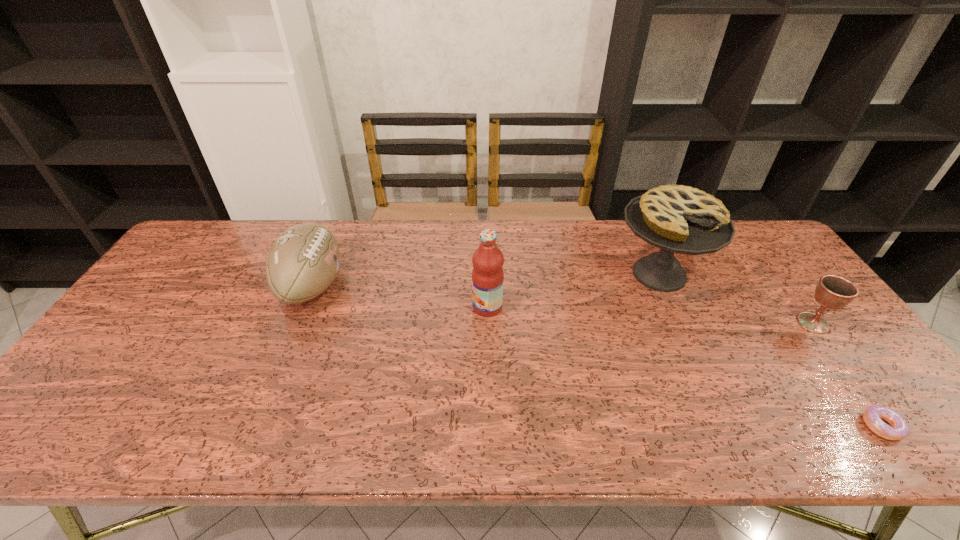
At what (x,y) coordinates should I click in order to perform the action: click on free area in between the fourth object from right to left and the chalice. Please return your answer as a coordinate pair (x, y). Image resolution: width=960 pixels, height=540 pixels. Looking at the image, I should click on (650, 315).

Locate an element on the screen. The width and height of the screenshot is (960, 540). vacant point located between the third shortest object and the nearest object is located at coordinates (597, 356).

Locate an element on the screen. Image resolution: width=960 pixels, height=540 pixels. free area in between the football (American) and the nearest object is located at coordinates (597, 356).

Choose which object is the third nearest neighbor to the leftmost object. Please provide its 2D coordinates. Your answer should be formatted as a tuple, i.e. [(x, y)], where the tuple contains the x and y coordinates of a point satisfying the conditions above.

[(834, 292)]

Select which object appears as the second closest to the doughnut. Please provide its 2D coordinates. Your answer should be formatted as a tuple, i.e. [(x, y)], where the tuple contains the x and y coordinates of a point satisfying the conditions above.

[(680, 219)]

The width and height of the screenshot is (960, 540). I want to click on free point that satisfies the following two spatial constraints: 1. on the back side of the chalice; 2. on the front label of the second object from left to right, so click(801, 307).

Locate an element on the screen. vacant space that satisfies the following two spatial constraints: 1. on the cut side of the pie; 2. on the right side of the chalice is located at coordinates (682, 323).

Identify the location of free spot that satisfies the following two spatial constraints: 1. on the back side of the shortest object; 2. on the right side of the chalice. (806, 323).

Find the location of a particular element. The height and width of the screenshot is (540, 960). vacant space that satisfies the following two spatial constraints: 1. on the cut side of the third object from left to right; 2. on the right side of the shortest object is located at coordinates (728, 426).

Locate an element on the screen. The image size is (960, 540). vacant space that satisfies the following two spatial constraints: 1. on the cut side of the pie; 2. on the left side of the chalice is located at coordinates (682, 323).